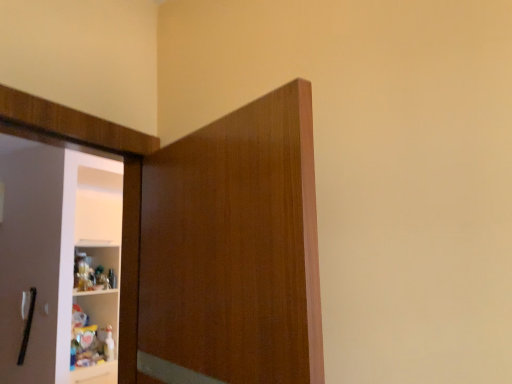
Question: Does matte wood cupboard at center have a greater width compared to black matte door handle at left?

Choices:
 (A) yes
 (B) no

Answer: (A)

Question: Is matte wood cupboard at center in contact with black matte door handle at left?

Choices:
 (A) yes
 (B) no

Answer: (B)

Question: Is matte wood cupboard at center closer to the viewer compared to black matte door handle at left?

Choices:
 (A) no
 (B) yes

Answer: (B)

Question: Considering the relative positions of matte wood cupboard at center and black matte door handle at left in the image provided, is matte wood cupboard at center behind black matte door handle at left?

Choices:
 (A) no
 (B) yes

Answer: (A)

Question: Is matte wood cupboard at center bigger than black matte door handle at left?

Choices:
 (A) yes
 (B) no

Answer: (A)

Question: From a real-world perspective, is matte wood cupboard at center positioned over black matte door handle at left based on gravity?

Choices:
 (A) no
 (B) yes

Answer: (B)

Question: Is black matte door handle at left taller than matte wood cupboard at center?

Choices:
 (A) no
 (B) yes

Answer: (A)

Question: From a real-world perspective, is black matte door handle at left on matte wood cupboard at center?

Choices:
 (A) yes
 (B) no

Answer: (B)

Question: Could you tell me if black matte door handle at left is facing matte wood cupboard at center?

Choices:
 (A) yes
 (B) no

Answer: (B)

Question: Is black matte door handle at left not near matte wood cupboard at center?

Choices:
 (A) yes
 (B) no

Answer: (A)

Question: Does black matte door handle at left appear on the left side of matte wood cupboard at center?

Choices:
 (A) no
 (B) yes

Answer: (B)

Question: Is black matte door handle at left not inside matte wood cupboard at center?

Choices:
 (A) yes
 (B) no

Answer: (A)

Question: From a real-world perspective, is matte wood cupboard at center physically located above or below black matte door handle at left?

Choices:
 (A) above
 (B) below

Answer: (A)